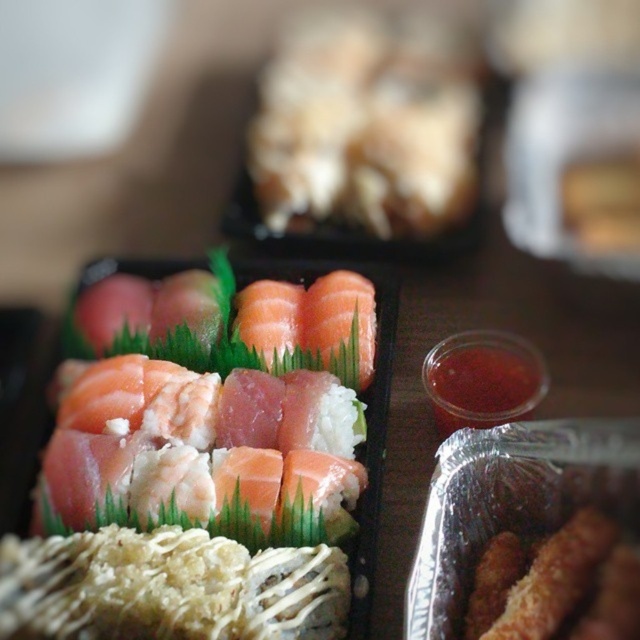
Is point (221, 397) positioned after point (387, 157)?

That is False.

What do you see at coordinates (225, 428) in the screenshot?
I see `pink raw fish at center` at bounding box center [225, 428].

The height and width of the screenshot is (640, 640). What are the coordinates of `pink raw fish at center` in the screenshot? It's located at (225, 428).